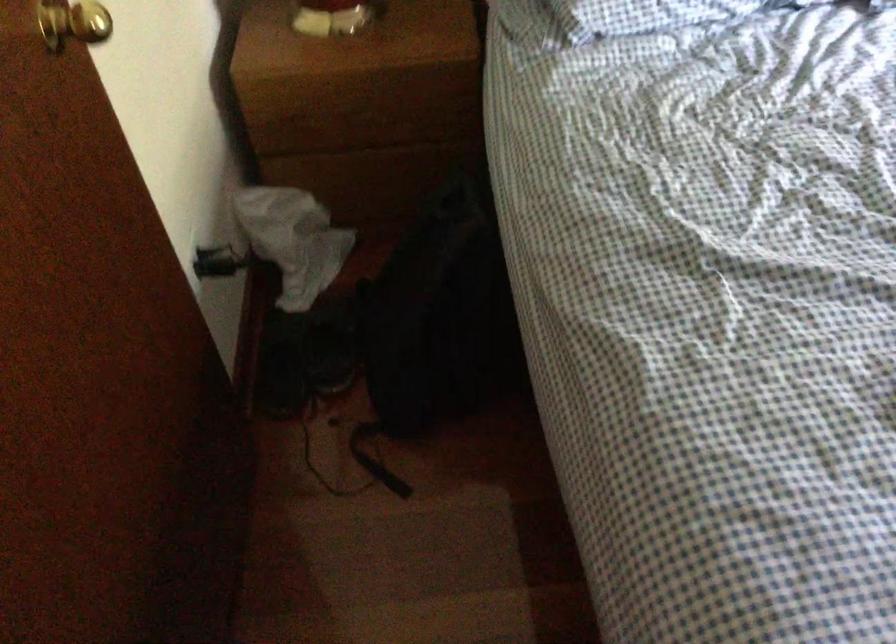
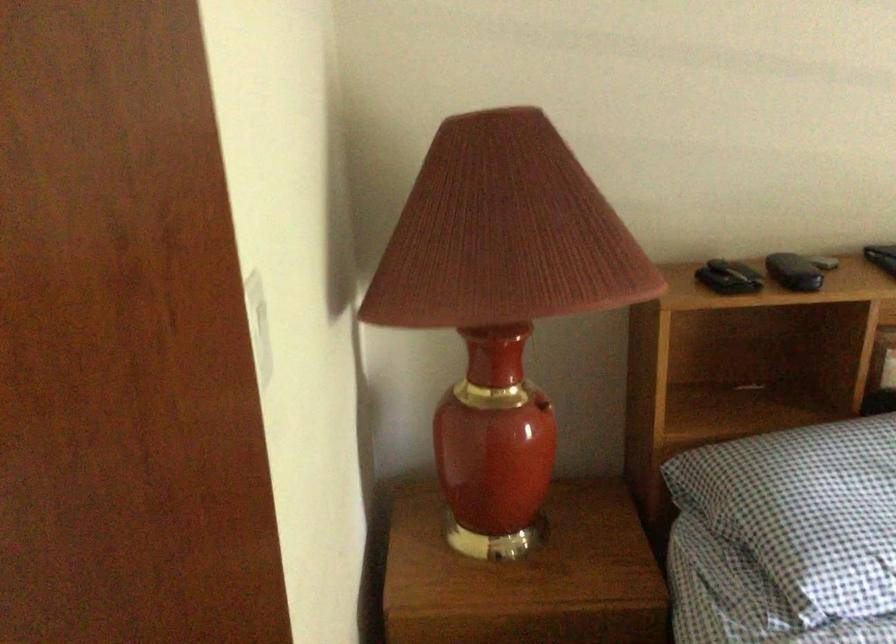
Question: How did the camera likely rotate?

Choices:
 (A) Left
 (B) Right
 (C) Up
 (D) Down

Answer: (C)